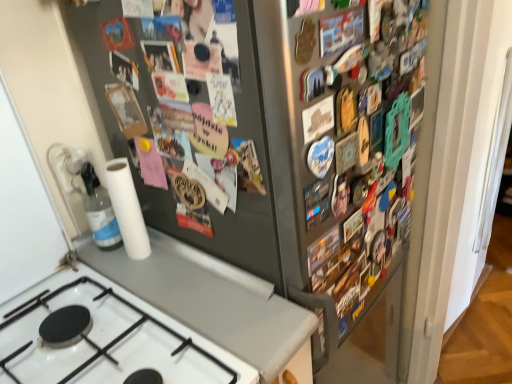
Question: Looking at the image, does transparent plastic bottle at lower left seem bigger or smaller compared to metallic button at upper center, the 2th button when ordered from right to left?

Choices:
 (A) small
 (B) big

Answer: (B)

Question: Which is correct: transparent plastic bottle at lower left is inside metallic button at upper center, which is the second button in left-to-right order, or outside of it?

Choices:
 (A) inside
 (B) outside

Answer: (B)

Question: Which is farther from the metallic gray refrigerator at left?

Choices:
 (A) white matte countertop at center
 (B) matte plastic photo frame at upper center, arranged as the second button when viewed from the top
 (C) satin finish fridge at upper right
 (D) transparent plastic bottle at lower left
 (E) metallic button at upper center, the 2th button when ordered from right to left

Answer: (E)

Question: Considering the real-world distances, which object is closest to the matte plastic photo frame at upper center, arranged as the second button when viewed from the top?

Choices:
 (A) metallic gray refrigerator at left
 (B) metallic button at upper center, marked as the first button in a bottom-to-top arrangement
 (C) satin finish fridge at upper right
 (D) metallic button at upper center, the first button when ordered from top to bottom
 (E) white glossy gas stove at lower left

Answer: (A)